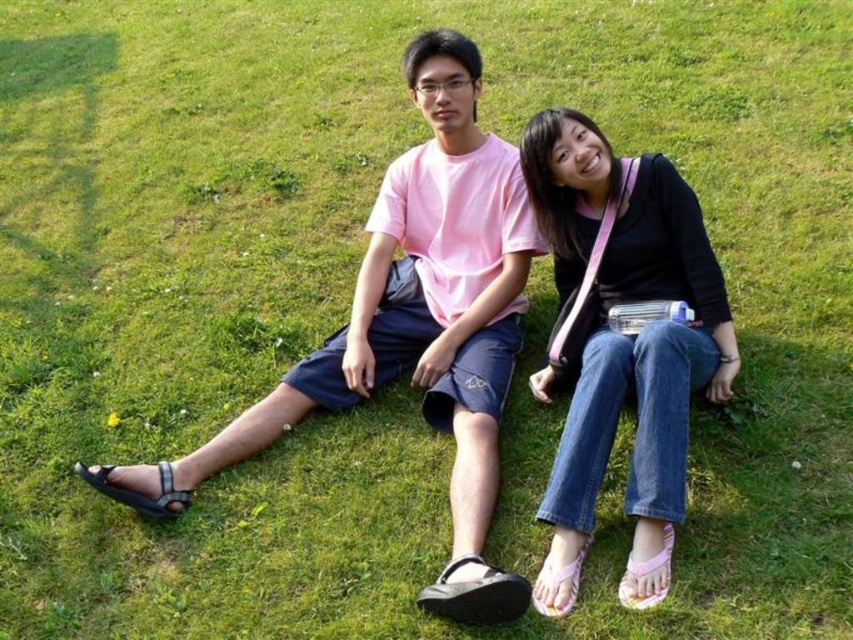
You are standing in the grassy field and want to walk from point (544, 205) to point (473, 605). Which direction should you move to get closer to your destination?

You should move away from the viewer because point (544, 205) is further to the viewer than point (473, 605).

You are standing on the grassy field and want to pick up the black rubber sandal at lower center. Which direction should you move to avoid stepping on the pink fabric sandal at lower center?

The black rubber sandal at lower center is in front of the pink fabric sandal at lower center. To avoid stepping on the pink fabric sandal at lower center, you should move backward from the black rubber sandal at lower center.